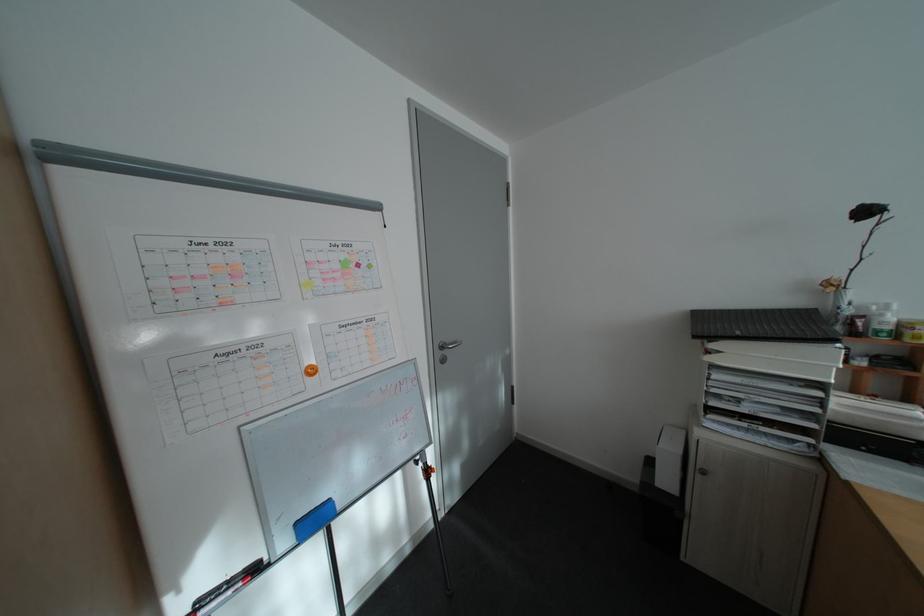
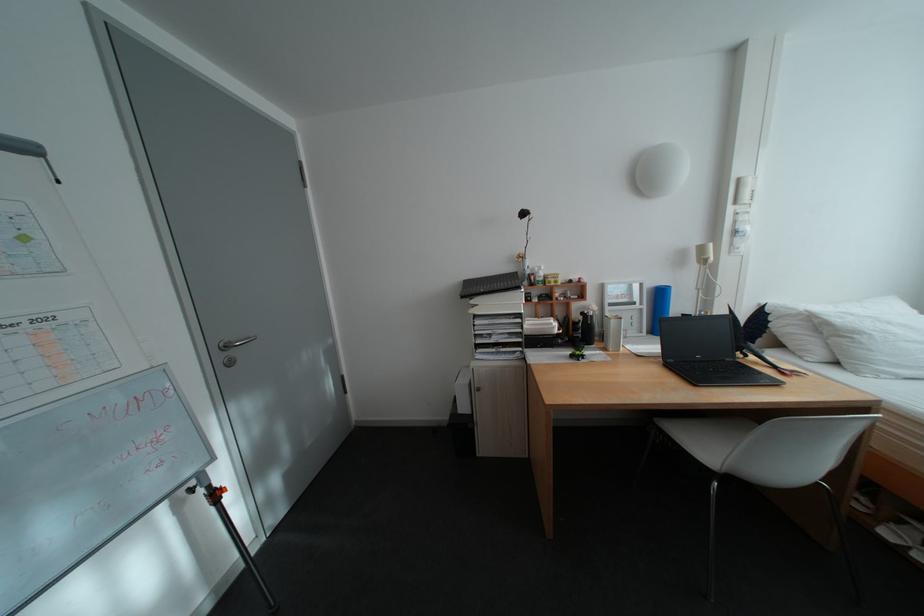
Locate, in the second image, the point that corresponds to (x=430, y=464) in the first image.

(203, 492)